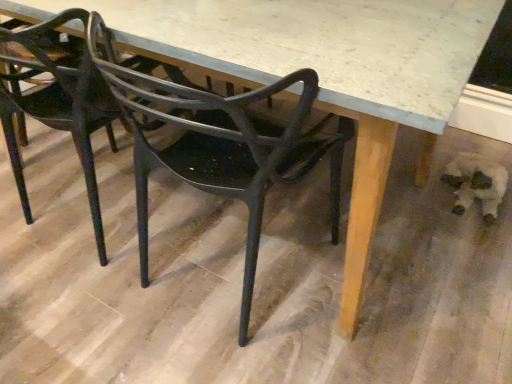
This screenshot has height=384, width=512. Find the location of `vacant area that lies in front of fuzzy white dog at lower right`. vacant area that lies in front of fuzzy white dog at lower right is located at coordinates (471, 232).